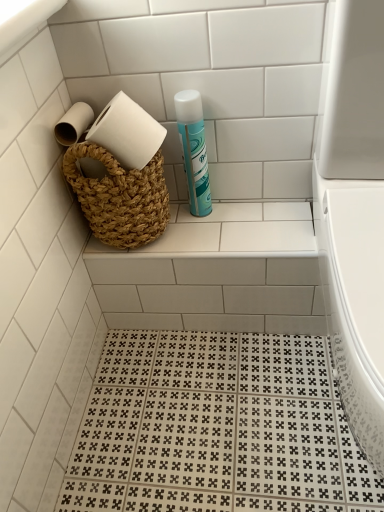
In order to click on vacant point to the right of teal matte cleaning product at upper center in this screenshot , I will do `click(254, 212)`.